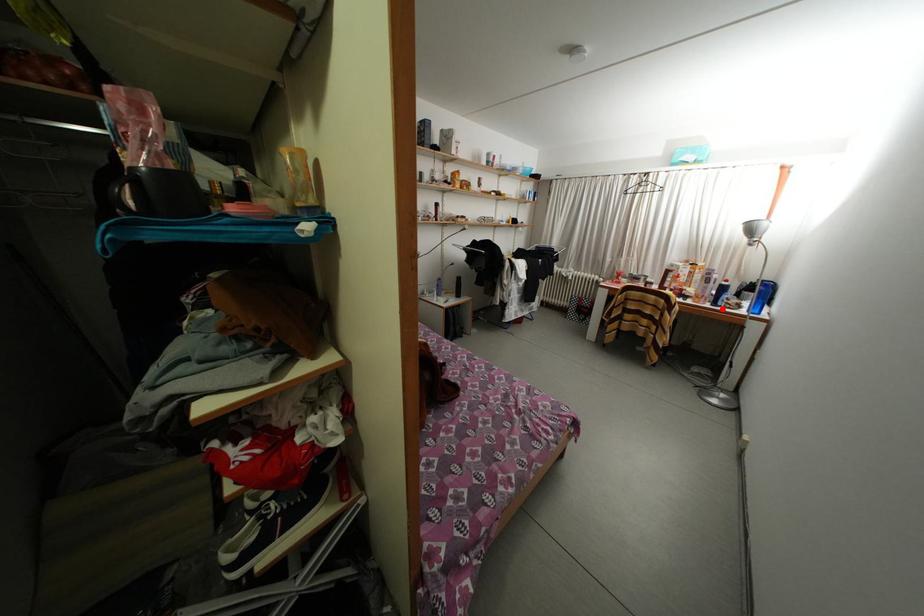
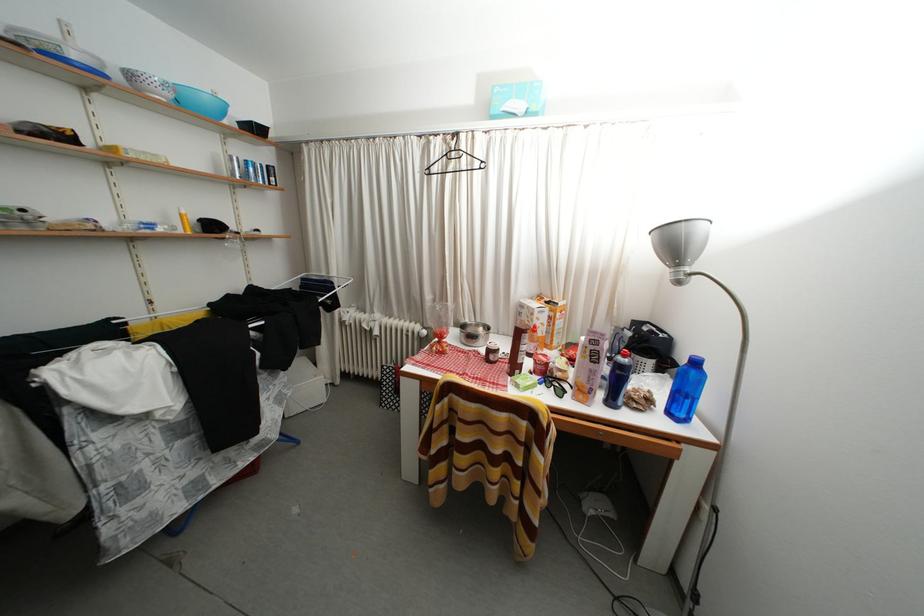
Question: A red point is marked in image1. In image2, is the corresponding 3D point closer to the camera or farther? Reply with the corresponding letter.

Choices:
 (A) The corresponding 3D point is closer.
 (B) The corresponding 3D point is farther.

Answer: (B)